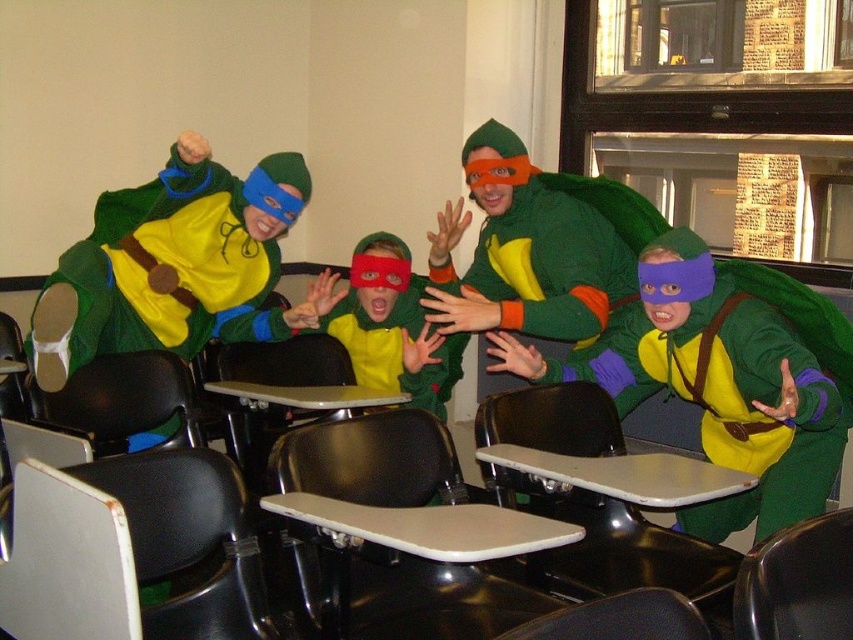
You are organizing a school play and need to ensure that the stage can accommodate both the matte green turtle costume at center and the white plastic table at center. Given that the stage has limited space, which object requires more horizontal space to fit properly?

The matte green turtle costume at center requires more horizontal space because its width surpasses that of the white plastic table at center.

You are a photographer setting up a shoot in this classroom scene. You need to position a spotlight exactly at the point marked by the coordinates point (x=717, y=385). What object will the spotlight illuminate?

The spotlight positioned at point (x=717, y=385) will illuminate the matte green turtle costume at center, as that is where the point is marked.

You are a teacher preparing for a classroom activity. You have two tables in the room, the smooth plastic table at center and the white plastic table at center. Which table should you choose if you need a larger surface area for placing materials?

The smooth plastic table at center is larger in size than the white plastic table at center, so you should choose the smooth plastic table at center for a larger surface area.